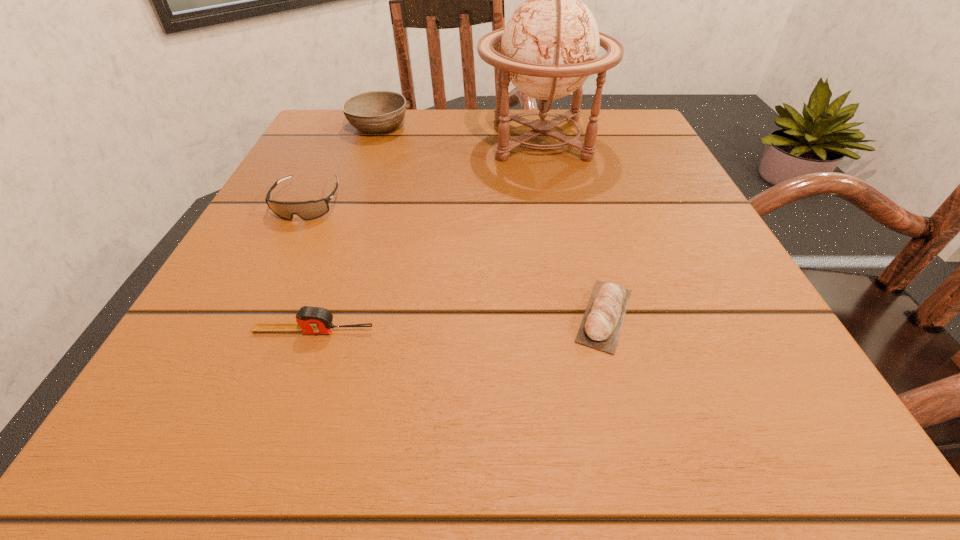
Locate an element on the screen. This screenshot has width=960, height=540. blank area at the far edge is located at coordinates tap(540, 151).

Image resolution: width=960 pixels, height=540 pixels. In the image, there is a desktop. Find the location of `free region at the left edge`. free region at the left edge is located at coordinates (266, 222).

In the image, there is a desktop. At what (x,y) coordinates should I click in order to perform the action: click on vacant space at the right edge. Please return your answer as a coordinate pair (x, y). Looking at the image, I should click on (666, 253).

I want to click on blank area at the far left corner, so coord(313,125).

Locate an element on the screen. Image resolution: width=960 pixels, height=540 pixels. vacant space at the far right corner of the desktop is located at coordinates (612, 152).

Where is `blank region between the pita bread and the tape measure`? blank region between the pita bread and the tape measure is located at coordinates (459, 323).

This screenshot has height=540, width=960. I want to click on blank region between the tape measure and the third nearest object, so click(311, 267).

Locate an element on the screen. vacant point located between the globe and the shortest object is located at coordinates (572, 227).

Locate an element on the screen. vacant space in between the tallest object and the pita bread is located at coordinates (572, 227).

Find the location of a particular element. Image resolution: width=960 pixels, height=540 pixels. free space between the shortest object and the tape measure is located at coordinates (459, 323).